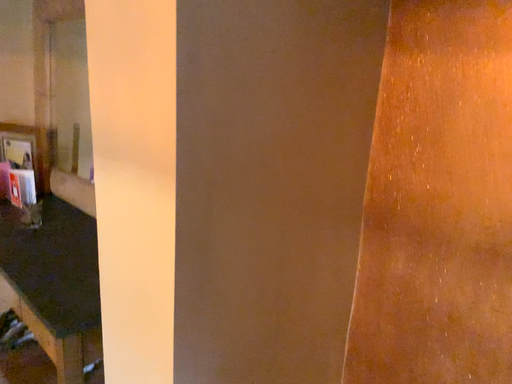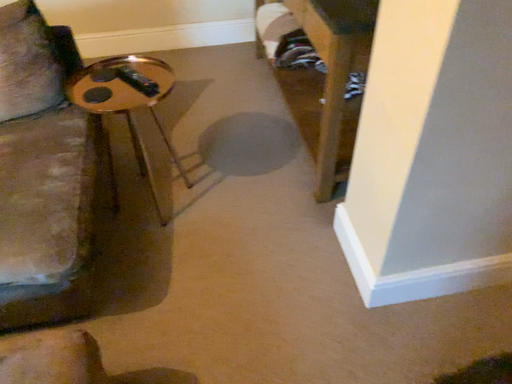
Question: Which way did the camera rotate in the video?

Choices:
 (A) rotated left
 (B) rotated right

Answer: (A)